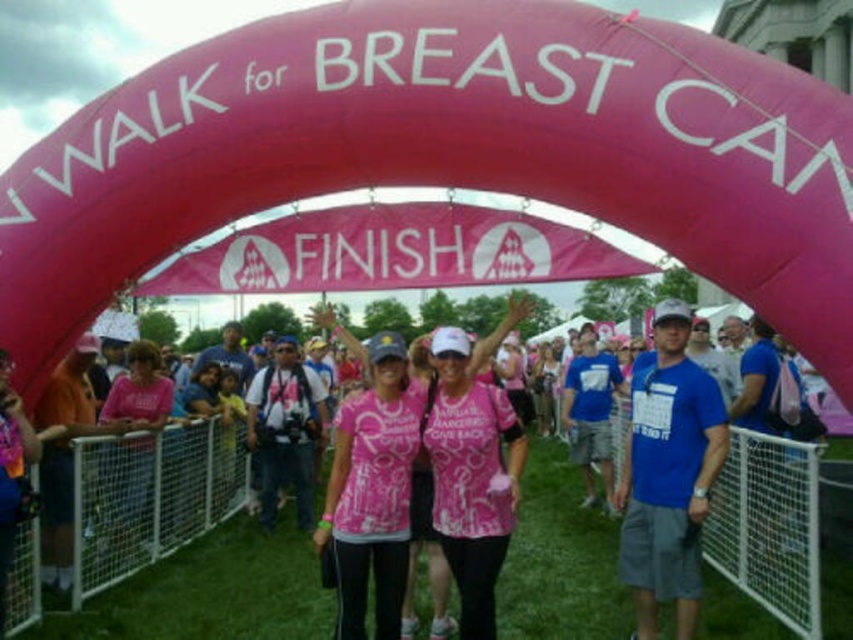
Who is positioned more to the left, pink fabric people at center or pink matte shirt at center?

pink matte shirt at center

Is pink fabric people at center bigger than pink matte shirt at center?

Yes, pink fabric people at center is bigger than pink matte shirt at center.

This screenshot has height=640, width=853. What are the coordinates of `pink fabric people at center` in the screenshot? It's located at (213, 593).